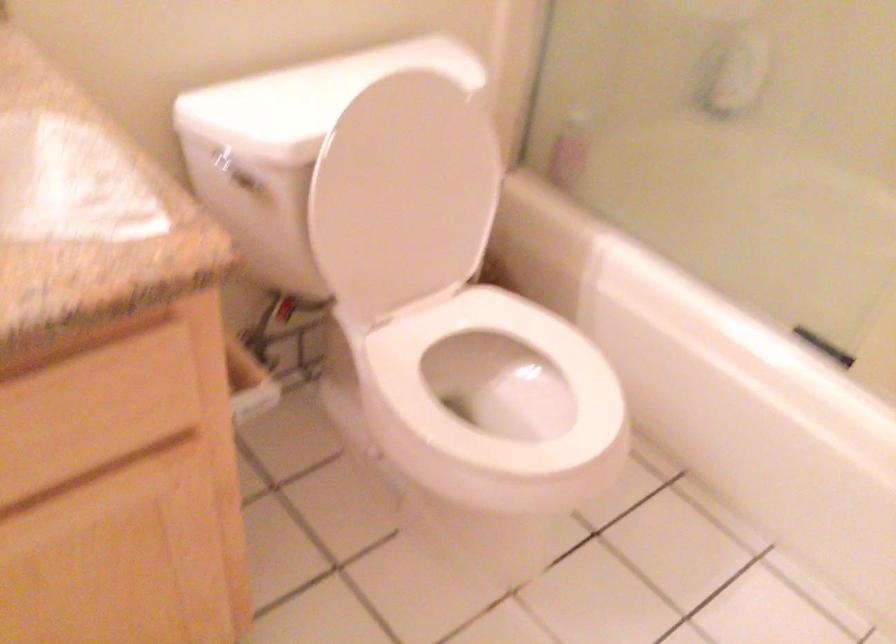
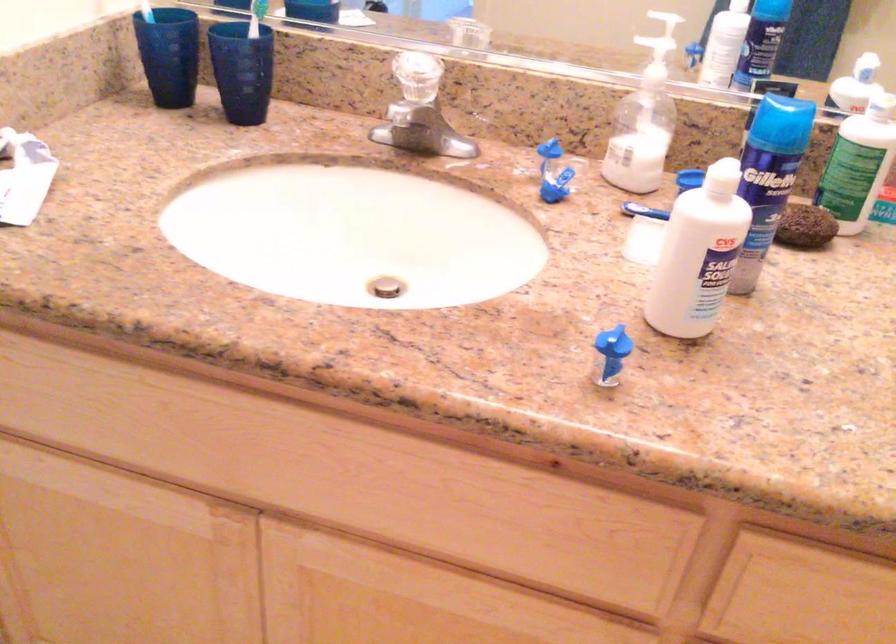
Question: The images are taken continuously from a first-person perspective. In which direction is your viewpoint rotating?

Choices:
 (A) Left
 (B) Right
 (C) Up
 (D) Down

Answer: (A)